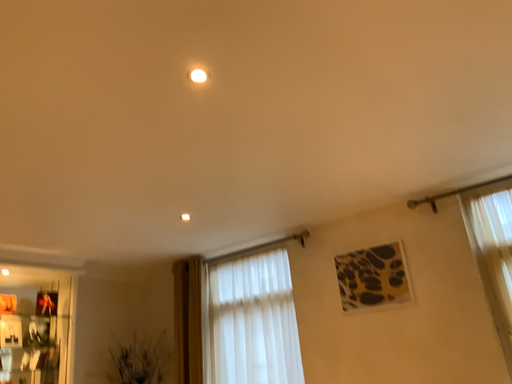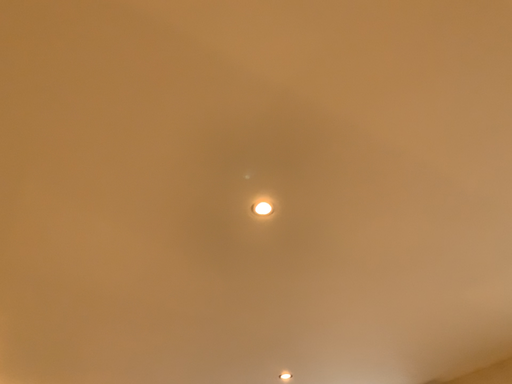
Question: How did the camera likely rotate when shooting the video?

Choices:
 (A) rotated upward
 (B) rotated downward

Answer: (A)